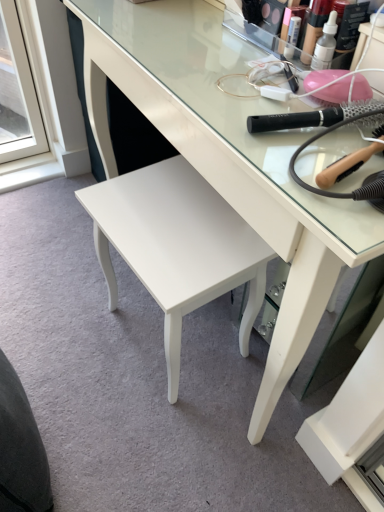
Image resolution: width=384 pixels, height=512 pixels. I want to click on vacant area that is in front of white glossy stool at center, so click(x=159, y=435).